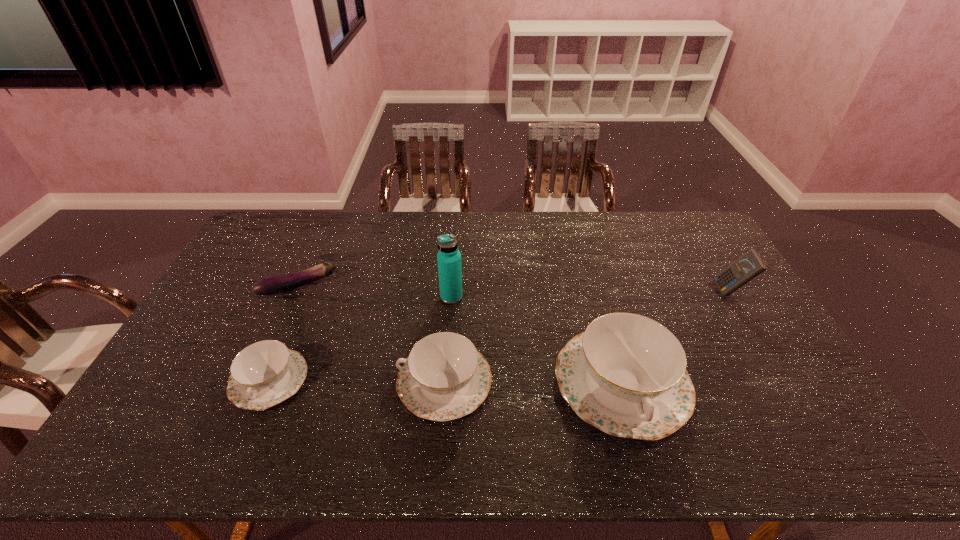
Identify the location of vacant space positioned on the handle side of the second chinaware from right to left. The width and height of the screenshot is (960, 540). (364, 382).

Where is `vacant space located on the handle side of the second chinaware from right to left`? vacant space located on the handle side of the second chinaware from right to left is located at coordinates (277, 382).

Locate an element on the screen. vacant space located 0.070m on the left of the shortest object is located at coordinates (240, 287).

I want to click on free space located on the front-facing side of the rightmost object, so click(x=622, y=292).

Find the location of `free space located 0.120m on the front-facing side of the rightmost object`. free space located 0.120m on the front-facing side of the rightmost object is located at coordinates (679, 292).

At what (x,y) coordinates should I click in order to perform the action: click on vacant space located 0.120m on the front-facing side of the rightmost object. Please return your answer as a coordinate pair (x, y). The image size is (960, 540). Looking at the image, I should click on (679, 292).

The width and height of the screenshot is (960, 540). I want to click on vacant space situated on the right of the water bottle, so click(557, 297).

Locate an element on the screen. object that is at the left edge is located at coordinates (278, 284).

Locate an element on the screen. Image resolution: width=960 pixels, height=540 pixels. object that is at the right edge is located at coordinates (750, 265).

Where is `free space at the far edge`? free space at the far edge is located at coordinates (456, 238).